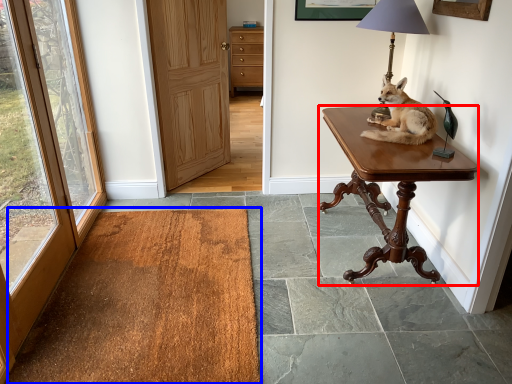
Question: Which point is further to the camera, desk (highlighted by a red box) or mat (highlighted by a blue box)?

Choices:
 (A) desk
 (B) mat

Answer: (A)